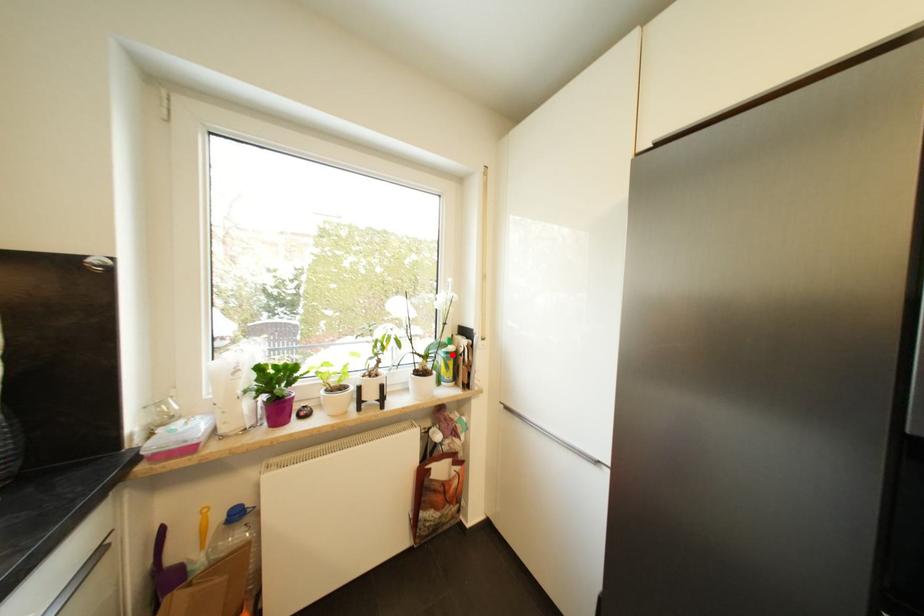
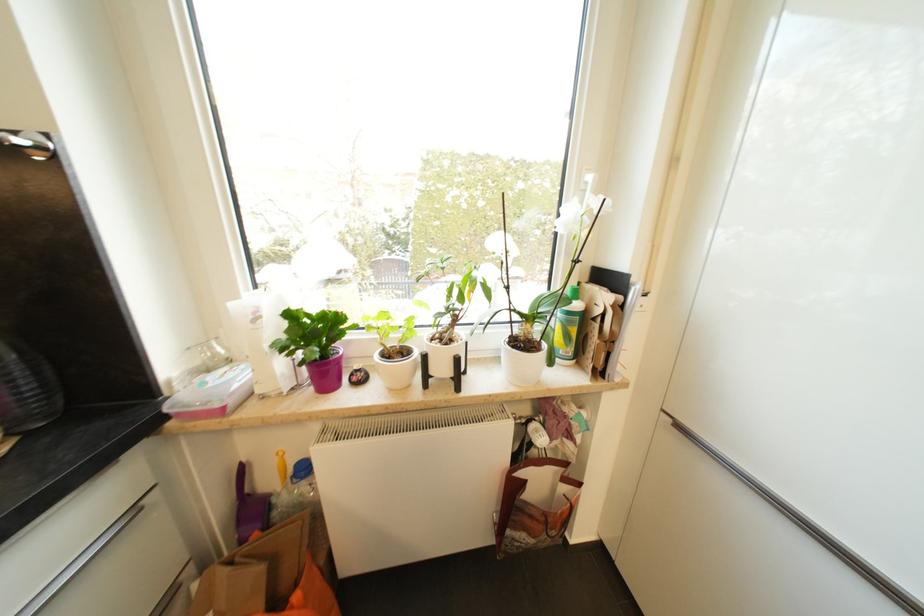
Locate, in the second image, the point that corresponds to the highlighted location in the first image.

(574, 315)